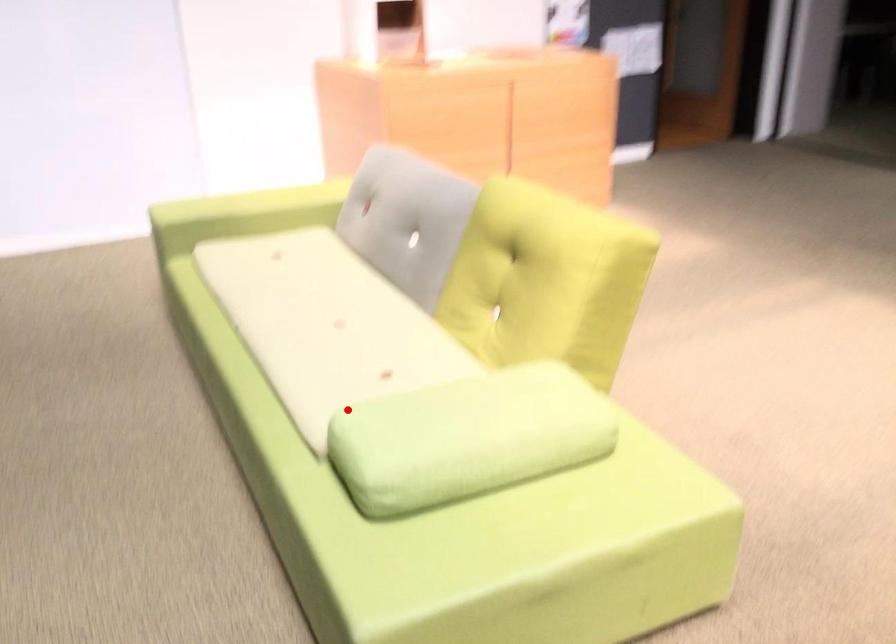
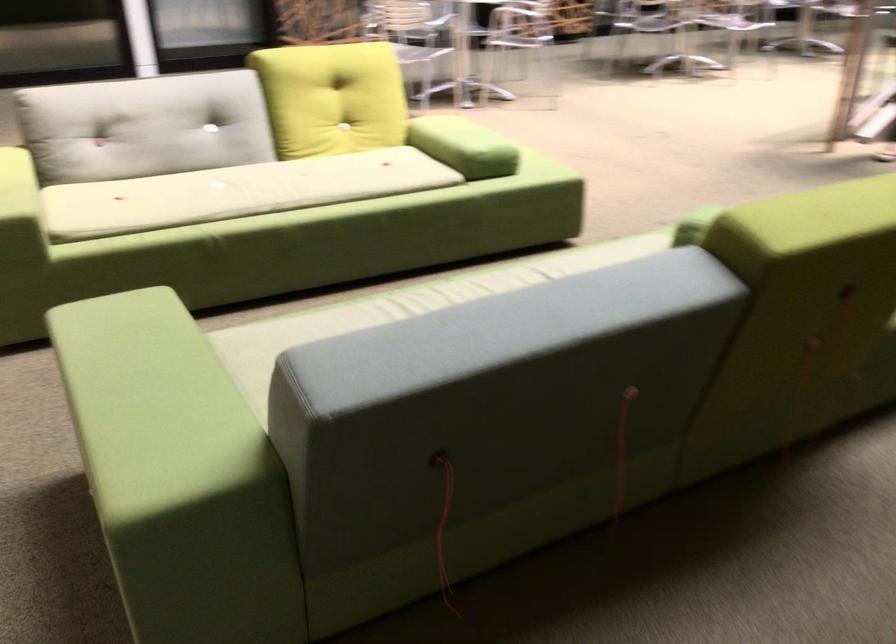
Locate, in the second image, the point that corresponds to the highlighted location in the first image.

(464, 146)